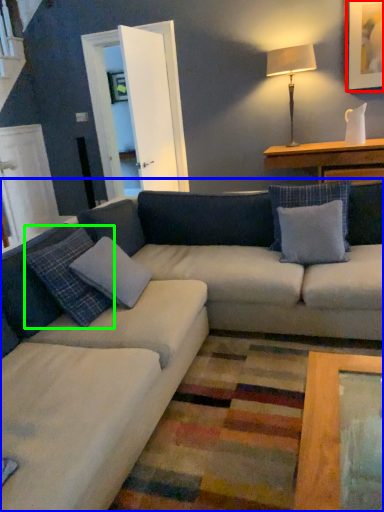
Question: Estimate the real-world distances between objects in this image. Which object is closer to picture frame (highlighted by a red box), studio couch (highlighted by a blue box) or pillow (highlighted by a green box)?

Choices:
 (A) studio couch
 (B) pillow

Answer: (A)